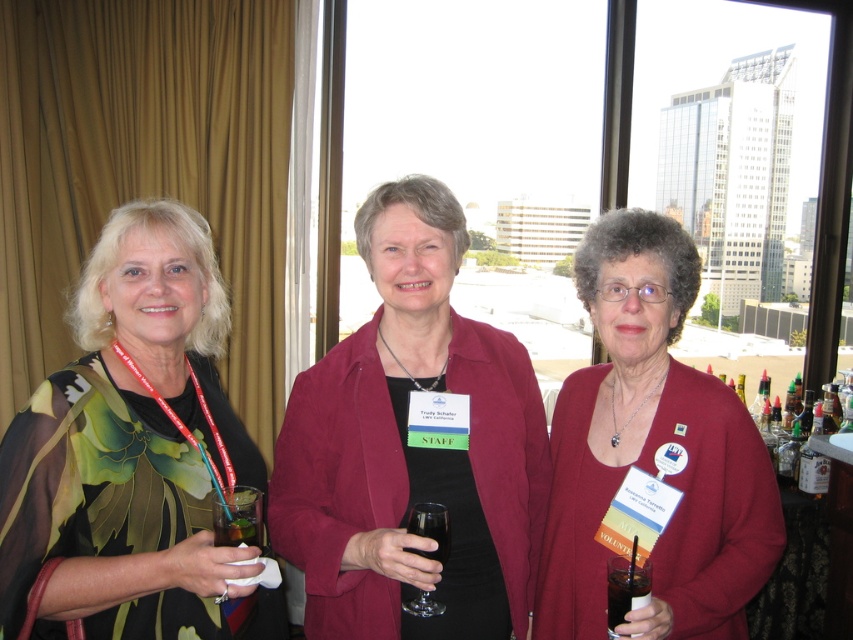
You are at a conference and want to hand a document to the woman in the maroon sweater at center. There is a dark liquid glass at center on the table between you and her. Can you reach her without moving the glass?

The maroon sweater at center is further to the viewer than the dark liquid glass at center, meaning the glass is closer to you. Therefore, you can reach the woman in the maroon sweater at center without moving the glass as she is behind it.

What is located at the point with coordinates (412, 445)?

The maroon suede jacket at center is located at the point with coordinates (412, 445).

You are organizing a clothing display and need to place the maroon suede jacket at center and the maroon sweater at center on a rack. The rack has a width of 10 inches. Can both items fit side by side on the rack without overlapping?

The distance between the maroon suede jacket at center and the maroon sweater at center is 11.13 inches. Since the rack is only 10 inches wide, they cannot fit side by side without overlapping.